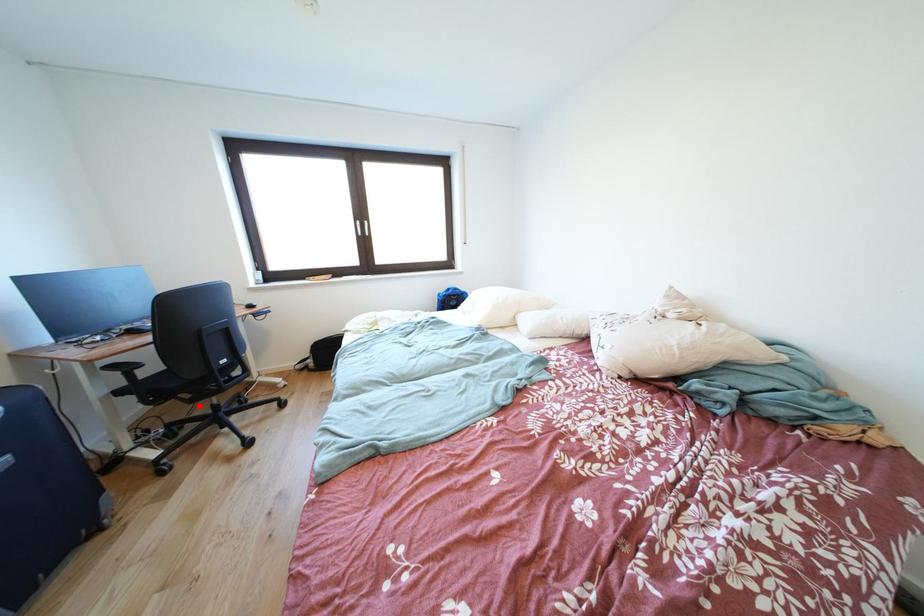
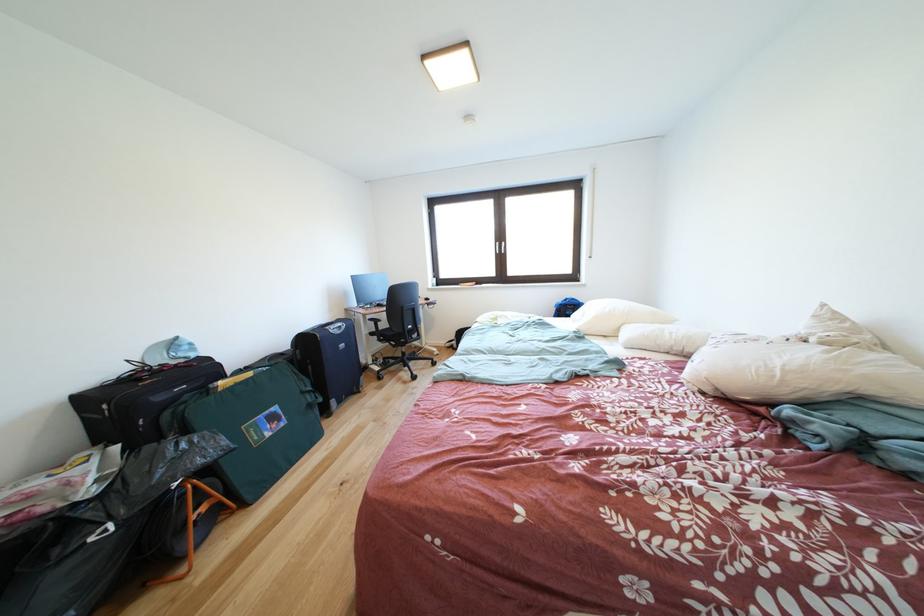
Where in the second image is the point corresponding to the highlighted location from the first image?

(403, 351)